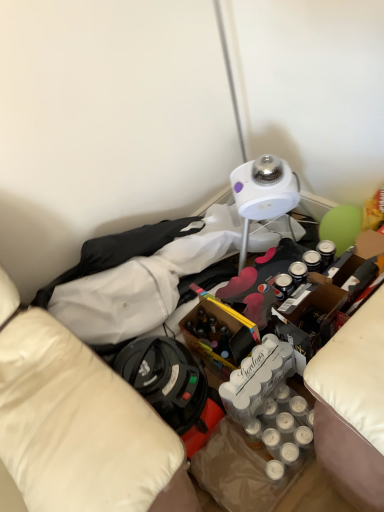
Question: Is translucent glass wine bottle at center inside or outside of white smooth shirt at upper left?

Choices:
 (A) inside
 (B) outside

Answer: (B)

Question: In terms of height, does translucent glass wine bottle at center look taller or shorter compared to white smooth shirt at upper left?

Choices:
 (A) short
 (B) tall

Answer: (B)

Question: Based on their sizes in the image, would you say translucent glass wine bottle at center is bigger or smaller than white smooth shirt at upper left?

Choices:
 (A) big
 (B) small

Answer: (B)

Question: From the image's perspective, relative to translucent glass wine bottle at center, is white smooth shirt at upper left above or below?

Choices:
 (A) below
 (B) above

Answer: (B)

Question: Is white smooth shirt at upper left bigger or smaller than translucent glass wine bottle at center?

Choices:
 (A) small
 (B) big

Answer: (B)

Question: Do you think white smooth shirt at upper left is within translucent glass wine bottle at center, or outside of it?

Choices:
 (A) inside
 (B) outside

Answer: (B)

Question: Would you say white smooth shirt at upper left is to the left or to the right of translucent glass wine bottle at center in the picture?

Choices:
 (A) right
 (B) left

Answer: (B)